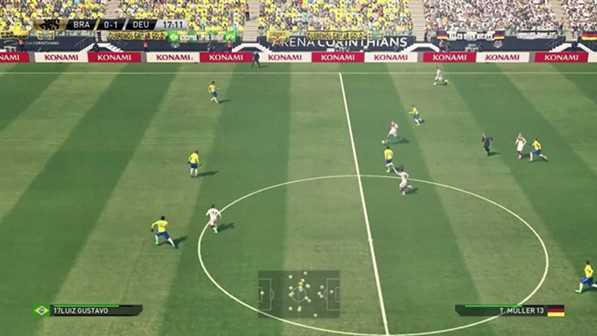
At what (x,y) coordinates should I click in order to perform the action: click on empty seats. Please return your answer as a coordinate pair (x, y). Looking at the image, I should click on (66, 39), (136, 45), (535, 41).